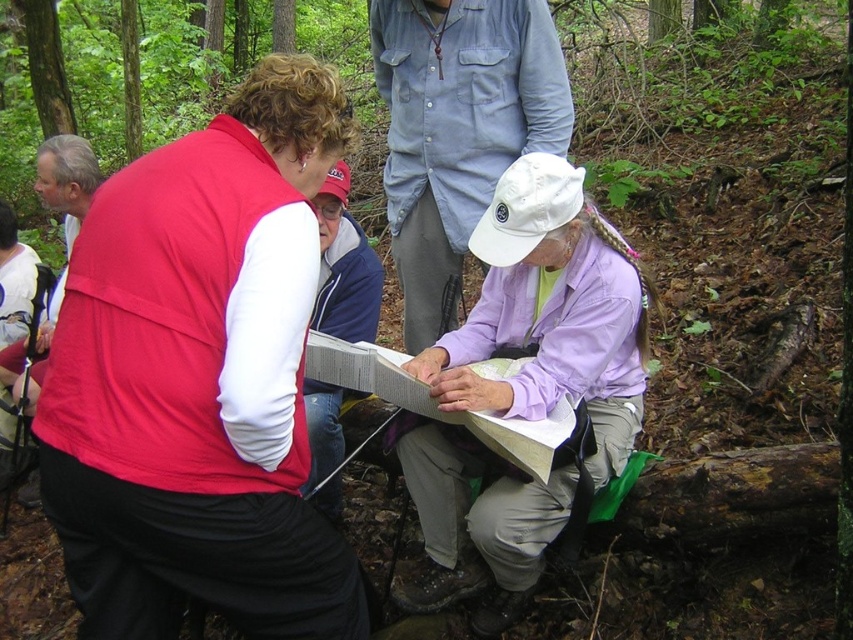
You are planning to take a photo of the blue denim jacket at center and the white shirt at upper left. Which object should you focus on first if you want to capture both in the same frame without moving the camera?

The blue denim jacket at center is smaller than the white shirt at upper left. To capture both in the same frame without moving the camera, focus on the blue denim jacket at center first since it is closer to the camera, allowing the white shirt at upper left to remain in the background.

You are a photographer trying to capture a group photo of the lavender fabric shirt at center and the blue denim jacket at center. Since you want both subjects to appear balanced in the frame, which subject should you position closer to the camera to compensate for their size difference?

The blue denim jacket at center should be positioned closer to the camera because the lavender fabric shirt at center is much taller, making the shorter blue denim jacket appear more balanced in size when moved forward.